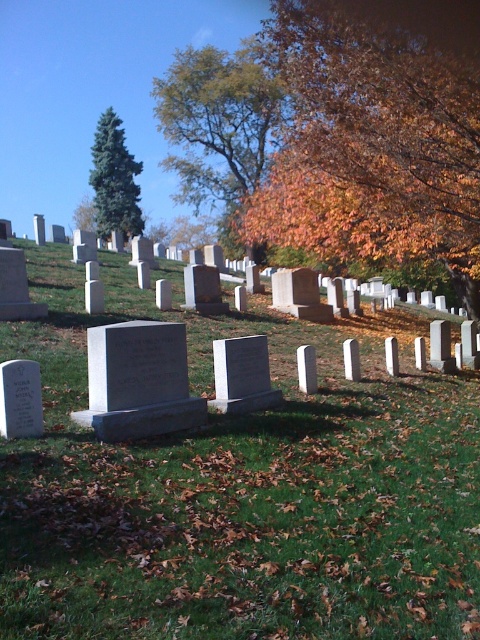
Which is behind, point (188, 621) or point (132, 221)?

The point (132, 221) is behind.

What do you see at coordinates (239, 490) in the screenshot? This screenshot has height=640, width=480. I see `green grassy at center` at bounding box center [239, 490].

Where is `green grassy at center`? green grassy at center is located at coordinates (239, 490).

Which is in front, point (445, 12) or point (218, 198)?

Positioned in front is point (445, 12).

Is orange leafy tree at upper center further to camera compared to green leafy tree at upper center?

No, it is in front of green leafy tree at upper center.

Image resolution: width=480 pixels, height=640 pixels. I want to click on orange leafy tree at upper center, so click(377, 134).

What do you see at coordinates (377, 134) in the screenshot? I see `orange leafy tree at upper center` at bounding box center [377, 134].

Which is more to the left, orange leafy tree at upper center or green matte evergreen tree at upper left?

green matte evergreen tree at upper left

The width and height of the screenshot is (480, 640). What do you see at coordinates (377, 134) in the screenshot? I see `orange leafy tree at upper center` at bounding box center [377, 134].

Locate an element on the screen. The image size is (480, 640). orange leafy tree at upper center is located at coordinates (377, 134).